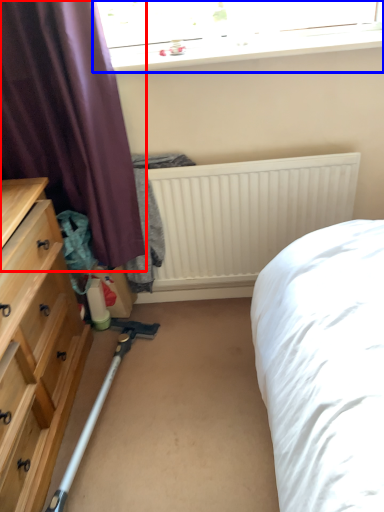
Question: Which of the following is the closest to the observer, curtain (highlighted by a red box) or window (highlighted by a blue box)?

Choices:
 (A) curtain
 (B) window

Answer: (A)